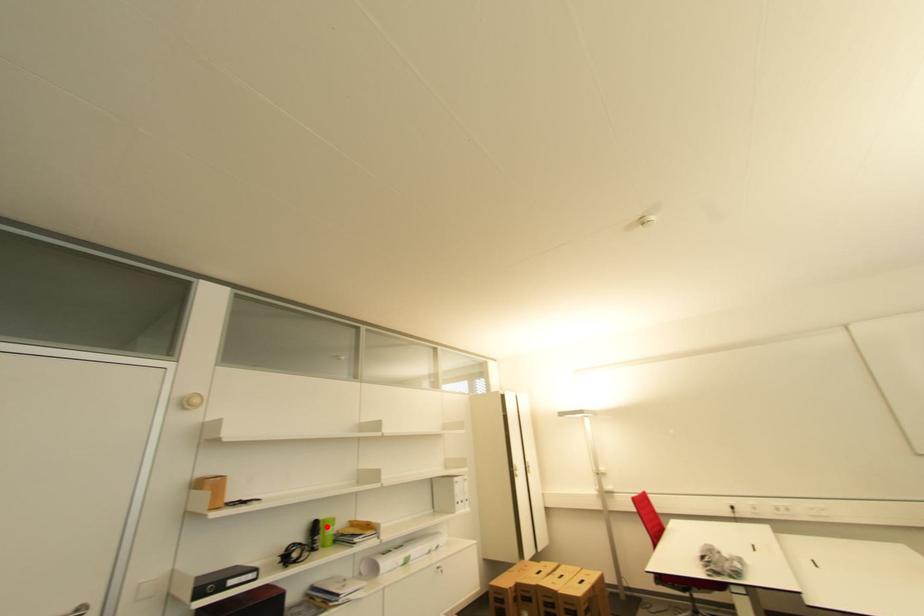
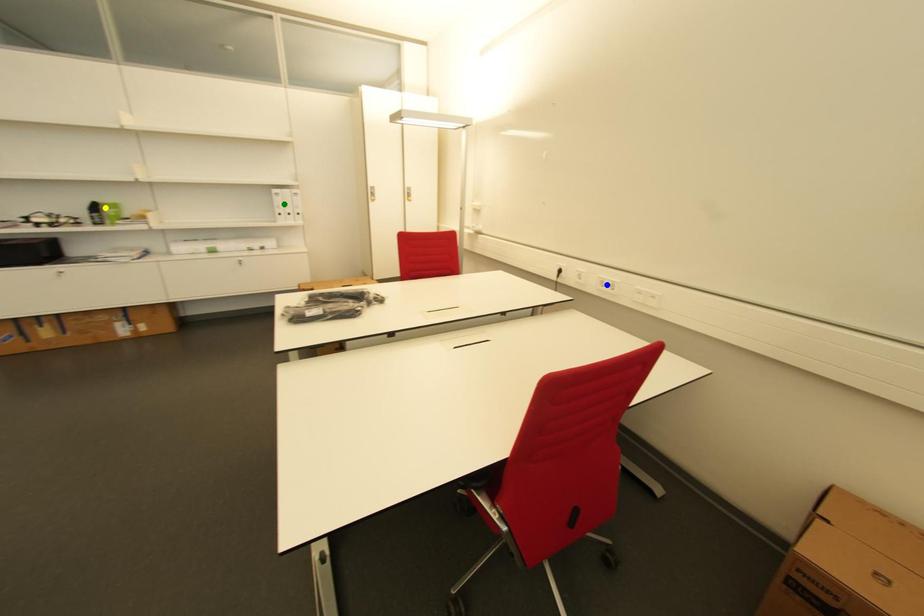
Question: I am providing you with two images of the same scene from different viewpoints. A red point is marked on the first image. You are given multiple points on the second image. In image 2, which mark is for the same physical point as the one in image 1?

Choices:
 (A) blue point
 (B) green point
 (C) yellow point

Answer: (C)